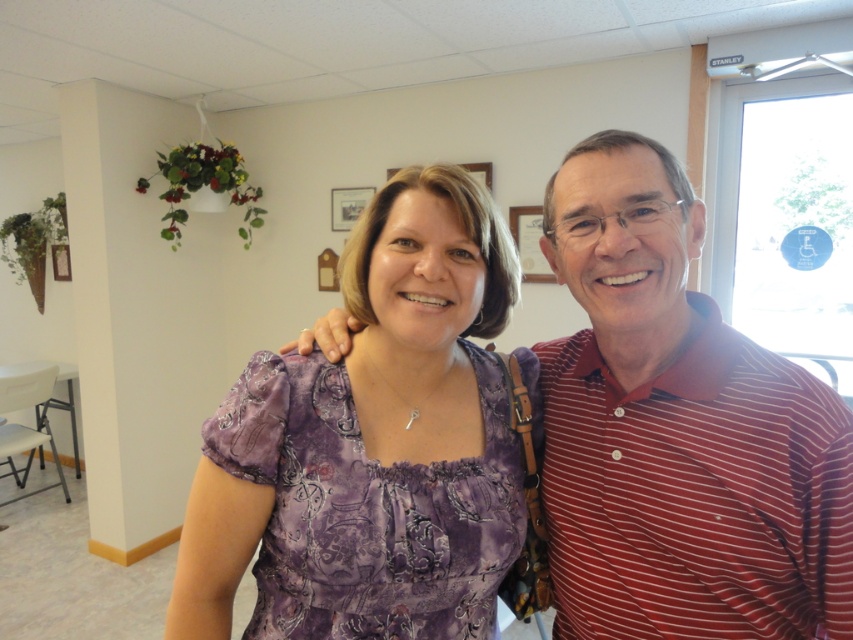
Question: Does striped cotton shirt at right have a greater width compared to purple printed dress at center?

Choices:
 (A) yes
 (B) no

Answer: (B)

Question: From the image, what is the correct spatial relationship of striped cotton shirt at right in relation to purple printed dress at center?

Choices:
 (A) below
 (B) above

Answer: (B)

Question: Does striped cotton shirt at right appear on the left side of purple printed dress at center?

Choices:
 (A) no
 (B) yes

Answer: (A)

Question: Which point is closer to the camera?

Choices:
 (A) 354,576
 (B) 570,595

Answer: (A)

Question: Which point appears closest to the camera in this image?

Choices:
 (A) (698, 500)
 (B) (398, 401)

Answer: (A)